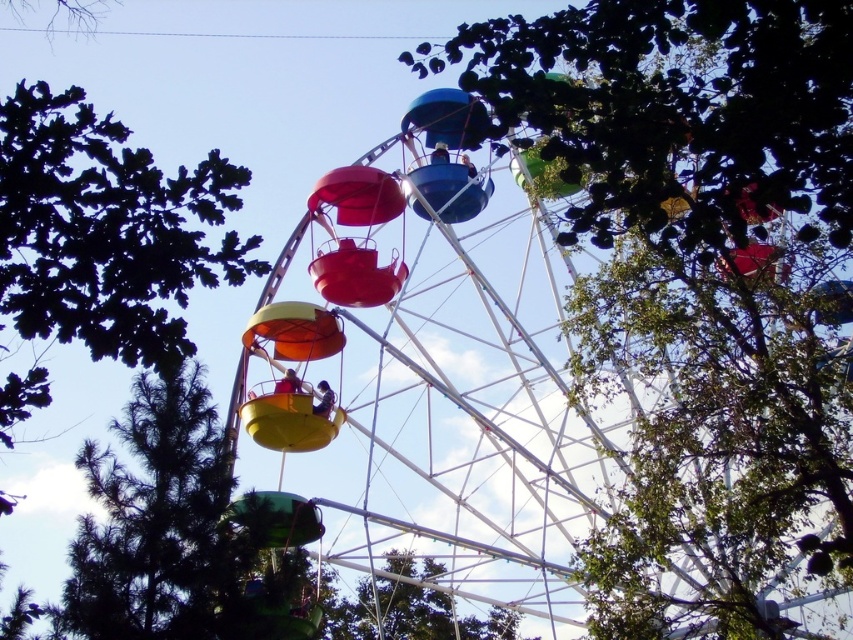
Question: Which of the following is the farthest from the observer?

Choices:
 (A) dark green leafy tree at lower left
 (B) green leafy tree at center
 (C) metallic ferris wheel at center

Answer: (B)

Question: Does metallic ferris wheel at center have a larger size compared to dark green leafy tree at lower left?

Choices:
 (A) yes
 (B) no

Answer: (A)

Question: Among these objects, which one is farthest from the camera?

Choices:
 (A) metallic ferris wheel at center
 (B) dark green leafy tree at lower left

Answer: (A)

Question: Is dark green leafy tree at lower left smaller than green leafy tree at center?

Choices:
 (A) no
 (B) yes

Answer: (A)

Question: Can you confirm if metallic ferris wheel at center is wider than green leafy tree at center?

Choices:
 (A) yes
 (B) no

Answer: (A)

Question: Among these points, which one is nearest to the camera?

Choices:
 (A) (3, 188)
 (B) (412, 586)
 (C) (506, 333)

Answer: (A)